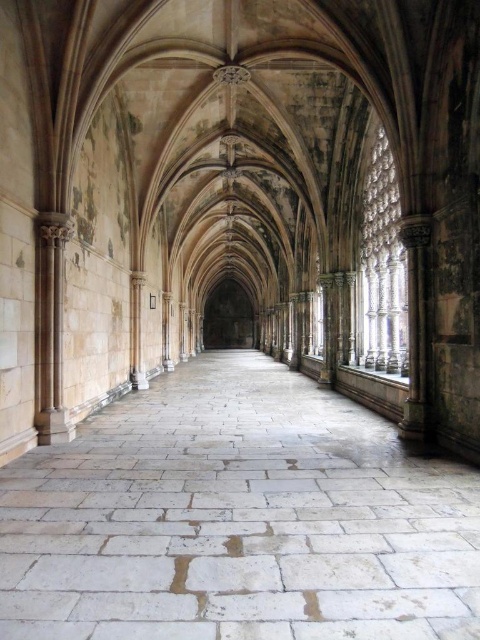
You are standing in the corridor and want to place a small decorative statue exactly at the center of the white stone floor at center. According to the coordinates provided, where should you place the statue?

You should place the statue at point (238,518) on the white stone floor at center.

You are a tour guide leading a group through the historic corridor. You want to point out the white stone floor at center and the light beige stone column at left. Which object is closer to the visitors as they enter the corridor?

The white stone floor at center is closer to the visitors as they enter the corridor because it is in front of the light beige stone column at left, meaning the column is further back.

You are standing in the corridor and want to place a small potted plant exactly at the center of the white stone floor at center. Given that the point coordinates are normalized between 0 and 1, can you confirm if the point marked at (238, 518) is indeed the center of the white stone floor at center?

The point marked at (238, 518) is indeed the center of the white stone floor at center as stated in the description.